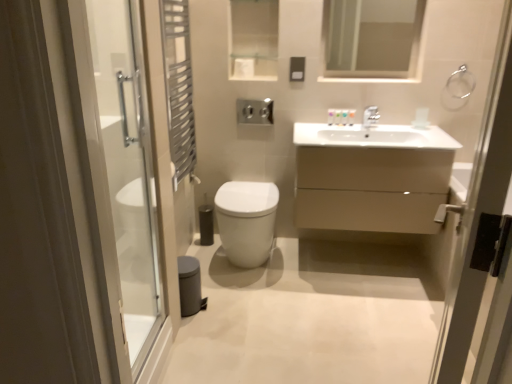
You are a GUI agent. You are given a task and a screenshot of the screen. Output one action in this format:
    pyautogui.click(x=<x>, y=<y>)
    Task: Click on the clear glass mirror at upper center
    This screenshot has height=384, width=512.
    Given the screenshot: What is the action you would take?
    pyautogui.click(x=373, y=38)

The width and height of the screenshot is (512, 384). What do you see at coordinates (178, 87) in the screenshot?
I see `metallic silver towel rack at left` at bounding box center [178, 87].

This screenshot has height=384, width=512. In order to click on satin nickel faucet at upper center in this screenshot , I will do `click(370, 117)`.

Find the location of a particular element. This screenshot has height=384, width=512. transparent glass shower door at left, which is the second screen door in right-to-left order is located at coordinates (129, 177).

The height and width of the screenshot is (384, 512). What do you see at coordinates (246, 220) in the screenshot? I see `white glossy toilet at center` at bounding box center [246, 220].

Identify the location of white glossy toilet at center. This screenshot has height=384, width=512. (246, 220).

Locate an element on the screen. This screenshot has width=512, height=384. matte beige cabinet at center is located at coordinates (371, 177).

Identify the location of clear glass mirror at upper center. (373, 38).

How many degrees apart are the facing directions of satin nickel faucet at upper center and metallic silver towel ring at right, which ranks as the second screen door in left-to-right order?

The angular difference between satin nickel faucet at upper center and metallic silver towel ring at right, which ranks as the second screen door in left-to-right order, is 112 degrees.

Is satin nickel faucet at upper center looking in the opposite direction of metallic silver towel ring at right, which ranks as the second screen door in left-to-right order?

No.

From a real-world perspective, which is physically above, satin nickel faucet at upper center or metallic silver towel ring at right, the first screen door positioned from the right?

satin nickel faucet at upper center, from a real-world perspective.

Between satin nickel faucet at upper center and metallic silver towel ring at right, which ranks as the second screen door in left-to-right order, which one is positioned behind?

satin nickel faucet at upper center is further away from the camera.

Is transparent glass shower door at left, which is the second screen door in right-to-left order, a part of white glossy toilet at center?

Actually, transparent glass shower door at left, which is the second screen door in right-to-left order, is outside white glossy toilet at center.

Can you tell me how much white glossy toilet at center and transparent glass shower door at left, which is the second screen door in right-to-left order, differ in facing direction?

They differ by 89.5 degrees in their facing directions.

From the image's perspective, would you say white glossy toilet at center is positioned over transparent glass shower door at left, the first screen door from the left?

No, from the image's perspective, white glossy toilet at center is not above transparent glass shower door at left, the first screen door from the left.

Is point (245, 264) closer to camera compared to point (80, 69)?

No, it is behind (80, 69).

Which is in front, metallic silver towel rack at left or matte beige cabinet at center?

metallic silver towel rack at left.

Which is nearer, (177, 100) or (401, 207)?

Positioned in front is point (401, 207).

In terms of size, does transparent glass shower door at left, which is the second screen door in right-to-left order, appear bigger or smaller than metallic silver towel ring at right, the first screen door positioned from the right?

Considering their sizes, transparent glass shower door at left, which is the second screen door in right-to-left order, takes up less space than metallic silver towel ring at right, the first screen door positioned from the right.

From the image's perspective, is transparent glass shower door at left, the first screen door from the left, beneath metallic silver towel ring at right, the first screen door positioned from the right?

No.

Is transparent glass shower door at left, the first screen door from the left, inside the boundaries of metallic silver towel ring at right, the first screen door positioned from the right, or outside?

transparent glass shower door at left, the first screen door from the left, is located beyond the bounds of metallic silver towel ring at right, the first screen door positioned from the right.

Is transparent glass shower door at left, the first screen door from the left, positioned in front of metallic silver towel ring at right, the first screen door positioned from the right?

No, it is behind metallic silver towel ring at right, the first screen door positioned from the right.

Who is more distant, white glossy toilet at center or silver metallic towel ring at upper right?

silver metallic towel ring at upper right is further away from the camera.

Considering the relative sizes of white glossy toilet at center and silver metallic towel ring at upper right in the image provided, is white glossy toilet at center shorter than silver metallic towel ring at upper right?

Incorrect, the height of white glossy toilet at center does not fall short of that of silver metallic towel ring at upper right.

From the image's perspective, between white glossy toilet at center and silver metallic towel ring at upper right, who is located below?

white glossy toilet at center appears lower in the image.

Does point (233, 252) come closer to viewer compared to point (473, 85)?

Yes, it is.

The width and height of the screenshot is (512, 384). Find the location of `shower curtain in front of the silver metallic towel ring at upper right`. shower curtain in front of the silver metallic towel ring at upper right is located at coordinates (178, 87).

Is metallic silver towel rack at left inside silver metallic towel ring at upper right?

No, silver metallic towel ring at upper right does not contain metallic silver towel rack at left.

Is metallic silver towel rack at left at the back of silver metallic towel ring at upper right?

silver metallic towel ring at upper right does not have its back to metallic silver towel rack at left.

From a real-world perspective, who is located higher, silver metallic towel ring at upper right or metallic silver towel rack at left?

silver metallic towel ring at upper right is physically above.

How many degrees apart are the facing directions of silver metallic towel ring at upper right and white glossy toilet at center?

The facing directions of silver metallic towel ring at upper right and white glossy toilet at center are 0.244 degrees apart.

Would you say silver metallic towel ring at upper right is inside or outside white glossy toilet at center?

silver metallic towel ring at upper right is spatially situated outside white glossy toilet at center.

Which is more to the right, silver metallic towel ring at upper right or white glossy toilet at center?

Positioned to the right is silver metallic towel ring at upper right.

Is silver metallic towel ring at upper right positioned with its back to white glossy toilet at center?

No.

From a real-world perspective, starting from the satin nickel faucet at upper center, which screen door is the 2nd one below it? Please provide its 2D coordinates.

[(478, 214)]

You are a GUI agent. You are given a task and a screenshot of the screen. Output one action in this format:
    pyautogui.click(x=<x>, y=<y>)
    Task: Click on the toilet that appears below the transparent glass shower door at left, which is the second screen door in right-to-left order (from the image's perspective)
    
    Given the screenshot: What is the action you would take?
    pyautogui.click(x=246, y=220)

Based on their spatial positions, is transparent glass shower door at left, which is the second screen door in right-to-left order, or satin nickel faucet at upper center further from clear glass mirror at upper center?

transparent glass shower door at left, which is the second screen door in right-to-left order, is further to clear glass mirror at upper center.

Which object lies further to the anchor point metallic silver towel rack at left, white glossy toilet at center or matte beige cabinet at center?

matte beige cabinet at center is positioned further to the anchor metallic silver towel rack at left.

From the image, which object appears to be farther from white glossy toilet at center, metallic silver towel ring at right, which ranks as the second screen door in left-to-right order, or satin nickel faucet at upper center?

metallic silver towel ring at right, which ranks as the second screen door in left-to-right order.

Looking at this image, when comparing their distances from matte beige cabinet at center, does clear glass mirror at upper center or silver metallic towel ring at upper right seem closer?

Among the two, clear glass mirror at upper center is located nearer to matte beige cabinet at center.

Which object lies nearer to the anchor point white glossy toilet at center, metallic silver towel ring at right, the first screen door positioned from the right, or silver metallic towel ring at upper right?

silver metallic towel ring at upper right lies closer to white glossy toilet at center than the other object.

From the image, which object appears to be farther from transparent glass shower door at left, which is the second screen door in right-to-left order, satin nickel faucet at upper center or matte beige cabinet at center?

Based on the image, satin nickel faucet at upper center appears to be further to transparent glass shower door at left, which is the second screen door in right-to-left order.

Which object lies nearer to the anchor point matte beige cabinet at center, white glossy toilet at center or transparent glass shower door at left, which is the second screen door in right-to-left order?

white glossy toilet at center.

Which object lies further to the anchor point clear glass mirror at upper center, silver metallic towel ring at upper right or white glossy toilet at center?

white glossy toilet at center.

Locate an element on the screen. toilet between metallic silver towel ring at right, which ranks as the second screen door in left-to-right order, and satin nickel faucet at upper center from front to back is located at coordinates (246, 220).

I want to click on shower curtain between clear glass mirror at upper center and white glossy toilet at center in the up-down direction, so click(x=178, y=87).

Locate an element on the screen. This screenshot has width=512, height=384. tap between metallic silver towel rack at left and silver metallic towel ring at upper right from left to right is located at coordinates (370, 117).

This screenshot has height=384, width=512. Find the location of `screen door located between metallic silver towel ring at right, which ranks as the second screen door in left-to-right order, and clear glass mirror at upper center in the depth direction`. screen door located between metallic silver towel ring at right, which ranks as the second screen door in left-to-right order, and clear glass mirror at upper center in the depth direction is located at coordinates click(x=129, y=177).